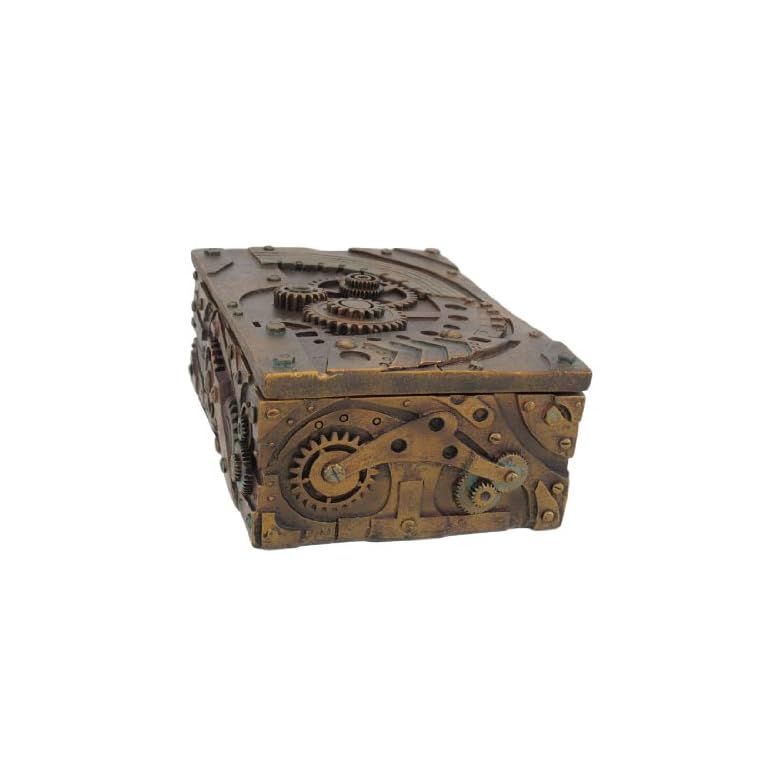
What are the coordinates of `lid of box` in the screenshot? It's located at (292, 336).